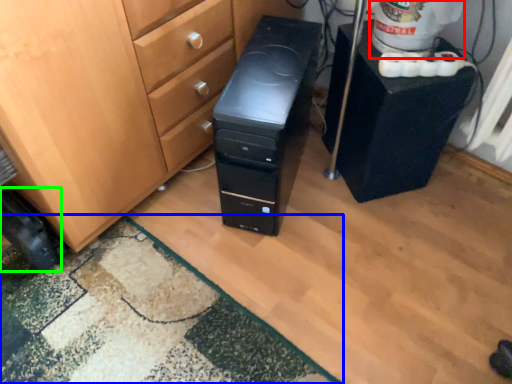
Question: Considering the real-world distances, which object is farthest from water cooler (highlighted by a red box)? doormat (highlighted by a blue box) or wheel (highlighted by a green box)?

Choices:
 (A) doormat
 (B) wheel

Answer: (B)